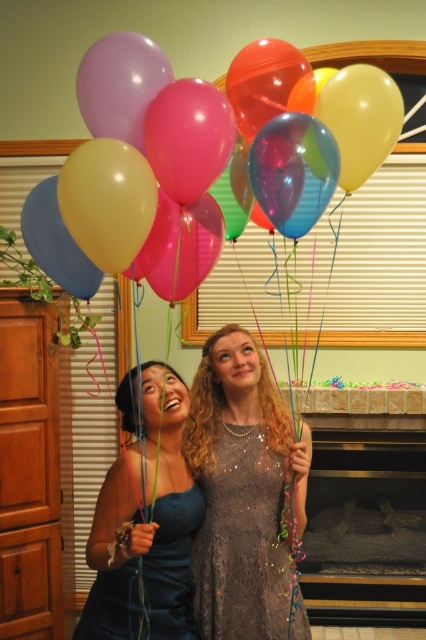
Question: Among these points, which one is nearest to the camera?

Choices:
 (A) (115, 246)
 (B) (299, 608)
 (C) (146, 564)

Answer: (A)

Question: Which object is positioned closest to the translucent glossy balloons at upper center?

Choices:
 (A) dark blue satin dress at lower left
 (B) sequined fabric dress at center

Answer: (B)

Question: Considering the real-world distances, which object is farthest from the sequined fabric dress at center?

Choices:
 (A) dark blue satin dress at lower left
 (B) translucent glossy balloons at upper center

Answer: (B)

Question: From the image, what is the correct spatial relationship of sequined fabric dress at center in relation to dark blue satin dress at lower left?

Choices:
 (A) left
 (B) right

Answer: (B)

Question: Is translucent glossy balloons at upper center thinner than sequined fabric dress at center?

Choices:
 (A) no
 (B) yes

Answer: (A)

Question: Is translucent glossy balloons at upper center thinner than dark blue satin dress at lower left?

Choices:
 (A) no
 (B) yes

Answer: (A)